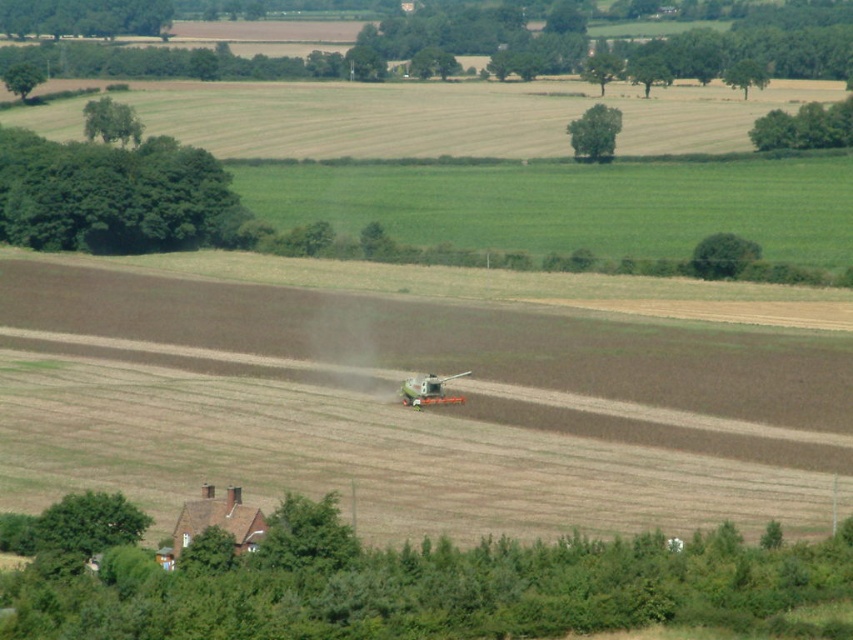
You are a farmer planning to plant new crops. You notice the brown soil at center in the image. Based on its location, can you determine if it is in the foreground or middle ground of the scene?

The brown soil at center is located at point (410, 410), which falls within the coordinates typically associated with the foreground in this scene. Therefore, the brown soil at center is in the foreground.

You are a farmer checking the field layout. You see the brown soil at center and the metallic orange agricultural equipment at center. Which object is located to the left of the other?

The brown soil at center is positioned on the left side of metallic orange agricultural equipment at center.

You are a farmer planning to plant a row of sunflowers between the brown soil at center and the metallic orange agricultural equipment at center. Based on the scene, can the sunflower row fit between them without overlapping either?

The brown soil at center is wider than the metallic orange agricultural equipment at center. Since the sunflower row needs space between them, it depends on the exact dimensions. However, the description only states the soil is wider, not the distance between them. Without knowing the required space for the sunflowers, we can only confirm the soil is wider but cannot determine fit.